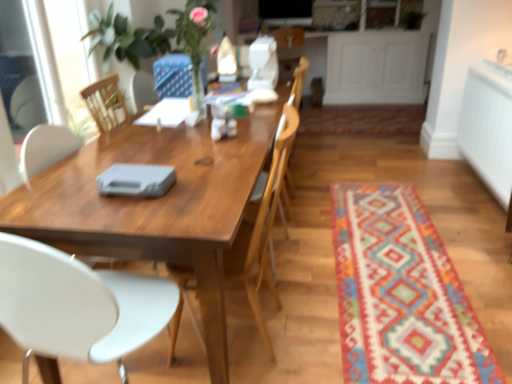
Based on the photo, what is the approximate width of wooden table at center?

80.85 centimeters.

What is the approximate width of blue fabric armchair at upper center, which is counted as the second armchair, starting from the right?

blue fabric armchair at upper center, which is counted as the second armchair, starting from the right, is 10.79 inches wide.

Measure the distance between blue fabric armchair at upper center, the 1th armchair viewed from the left, and camera.

blue fabric armchair at upper center, the 1th armchair viewed from the left, and camera are 8.07 feet apart from each other.

What do you see at coordinates (298, 81) in the screenshot? The height and width of the screenshot is (384, 512). I see `wooden chair at center, the 2th armchair in the left-to-right sequence` at bounding box center [298, 81].

Locate an element on the screen. Image resolution: width=512 pixels, height=384 pixels. wooden chair at center, which is the first chair in right-to-left order is located at coordinates (262, 226).

What is the approximate width of wooden chair at center, acting as the 2th chair starting from the left?

It is 19.82 inches.

The image size is (512, 384). What do you see at coordinates (401, 293) in the screenshot?
I see `multicolored woven mat at lower right, which ranks as the 2th mat in back-to-front order` at bounding box center [401, 293].

Identify the location of white textured radiator at right. (488, 126).

The width and height of the screenshot is (512, 384). Find the location of `wooden table at center`. wooden table at center is located at coordinates (155, 205).

Does white plastic chair at left, marked as the first chair in a left-to-right arrangement, contain wooden table at center?

No, wooden table at center is located outside of white plastic chair at left, marked as the first chair in a left-to-right arrangement.

Considering the points (150, 302) and (151, 212), which point is in front, point (150, 302) or point (151, 212)?

Positioned in front is point (151, 212).

Locate an element on the screen. kitchen & dining room table located above the white plastic chair at left, marked as the first chair in a left-to-right arrangement (from the image's perspective) is located at coordinates (155, 205).

From the image's perspective, is multicolored woven mat at lower right, the first mat in the front-to-back sequence, below multicolored woven rug at center, the first mat when ordered from top to bottom?

Yes, from the image's perspective, multicolored woven mat at lower right, the first mat in the front-to-back sequence, is below multicolored woven rug at center, the first mat when ordered from top to bottom.

Can you confirm if multicolored woven mat at lower right, the first mat in the front-to-back sequence, is smaller than multicolored woven rug at center, the first mat when ordered from top to bottom?

Correct, multicolored woven mat at lower right, the first mat in the front-to-back sequence, occupies less space than multicolored woven rug at center, the first mat when ordered from top to bottom.

Considering the sizes of objects multicolored woven mat at lower right, the first mat in the front-to-back sequence, and multicolored woven rug at center, which appears as the second mat when ordered from the bottom, in the image provided, who is thinner, multicolored woven mat at lower right, the first mat in the front-to-back sequence, or multicolored woven rug at center, which appears as the second mat when ordered from the bottom,?

Thinner between the two is multicolored woven mat at lower right, the first mat in the front-to-back sequence.

How many degrees apart are the facing directions of multicolored woven mat at lower right, the first mat positioned from the bottom, and multicolored woven rug at center, the first mat when ordered from top to bottom?

91.5 degrees.

Between multicolored woven mat at lower right, the first mat positioned from the bottom, and wooden chair at center, which is counted as the 1th armchair, starting from the right, which one is positioned behind?

wooden chair at center, which is counted as the 1th armchair, starting from the right, is behind.

How much distance is there between multicolored woven mat at lower right, the first mat in the front-to-back sequence, and wooden chair at center, which is counted as the 1th armchair, starting from the right?

multicolored woven mat at lower right, the first mat in the front-to-back sequence, and wooden chair at center, which is counted as the 1th armchair, starting from the right, are 3.34 feet apart from each other.

Would you say multicolored woven mat at lower right, arranged as the second mat when viewed from the top, contains wooden chair at center, which is counted as the 1th armchair, starting from the right?

Actually, wooden chair at center, which is counted as the 1th armchair, starting from the right, is outside multicolored woven mat at lower right, arranged as the second mat when viewed from the top.

Is multicolored woven mat at lower right, the first mat in the front-to-back sequence, looking in the opposite direction of wooden chair at center, the 2th armchair in the left-to-right sequence?

multicolored woven mat at lower right, the first mat in the front-to-back sequence, is not turned away from wooden chair at center, the 2th armchair in the left-to-right sequence.

Is white plastic chair at left, marked as the second chair in a right-to-left arrangement, thinner than wooden chair at center, acting as the 2th chair starting from the left?

Indeed, white plastic chair at left, marked as the second chair in a right-to-left arrangement, has a lesser width compared to wooden chair at center, acting as the 2th chair starting from the left.

Is white plastic chair at left, marked as the first chair in a left-to-right arrangement, spatially inside wooden chair at center, which is the first chair in right-to-left order, or outside of it?

white plastic chair at left, marked as the first chair in a left-to-right arrangement, exists outside the volume of wooden chair at center, which is the first chair in right-to-left order.

Between white plastic chair at left, marked as the first chair in a left-to-right arrangement, and wooden chair at center, which is the first chair in right-to-left order, which one has less height?

With less height is white plastic chair at left, marked as the first chair in a left-to-right arrangement.

Identify the location of chair above the white plastic chair at left, marked as the second chair in a right-to-left arrangement (from the image's perspective). (262, 226).

Is point (15, 191) positioned after point (417, 111)?

No, it is not.

From the image's perspective, which object appears higher, wooden table at center or multicolored woven rug at center, which is the first mat in back-to-front order?

From the image's view, multicolored woven rug at center, which is the first mat in back-to-front order, is above.

Does wooden table at center have a larger size compared to multicolored woven rug at center, which appears as the second mat when ordered from the bottom?

Yes.

Looking at this image, considering the relative positions of wooden table at center and multicolored woven rug at center, which is the first mat in back-to-front order, in the image provided, is wooden table at center to the left or to the right of multicolored woven rug at center, which is the first mat in back-to-front order,?

In the image, wooden table at center appears on the left side of multicolored woven rug at center, which is the first mat in back-to-front order.

Can you see multicolored woven rug at center, which appears as the second mat when viewed from the front, touching wooden chair at center, which is the first chair in right-to-left order?

No, multicolored woven rug at center, which appears as the second mat when viewed from the front, is not making contact with wooden chair at center, which is the first chair in right-to-left order.

Which is in front, multicolored woven rug at center, which appears as the second mat when viewed from the front, or wooden chair at center, acting as the 2th chair starting from the left?

wooden chair at center, acting as the 2th chair starting from the left, is closer to the camera.

Considering the sizes of objects multicolored woven rug at center, which is the first mat in back-to-front order, and wooden chair at center, which is the first chair in right-to-left order, in the image provided, who is smaller, multicolored woven rug at center, which is the first mat in back-to-front order, or wooden chair at center, which is the first chair in right-to-left order,?

multicolored woven rug at center, which is the first mat in back-to-front order.

What are the coordinates of `mat above the wooden chair at center, acting as the 2th chair starting from the left (from the image's perspective)` in the screenshot? It's located at (362, 119).

I want to click on kitchen & dining room table beneath the white textured radiator at right (from a real-world perspective), so click(155, 205).

Considering the relative sizes of wooden table at center and white textured radiator at right in the image provided, is wooden table at center taller than white textured radiator at right?

Indeed, wooden table at center has a greater height compared to white textured radiator at right.

Would you say wooden table at center contains white textured radiator at right?

No, wooden table at center does not contain white textured radiator at right.

Where is `the 2nd chair below the wooden table at center (from the image's perspective)`? The image size is (512, 384). the 2nd chair below the wooden table at center (from the image's perspective) is located at coordinates (77, 304).

At what (x,y) coordinates should I click in order to perform the action: click on mat on the left of the multicolored woven rug at center, which appears as the second mat when ordered from the bottom. Please return your answer as a coordinate pair (x, y). The width and height of the screenshot is (512, 384). Looking at the image, I should click on (401, 293).

Looking at the image, which one is located further to multicolored woven rug at center, which appears as the second mat when viewed from the front, white plastic chair at left, marked as the first chair in a left-to-right arrangement, or wooden chair at center, acting as the 2th chair starting from the left?

white plastic chair at left, marked as the first chair in a left-to-right arrangement, lies further to multicolored woven rug at center, which appears as the second mat when viewed from the front, than the other object.

Based on their spatial positions, is white plastic chair at left, marked as the second chair in a right-to-left arrangement, or multicolored woven mat at lower right, which ranks as the 2th mat in back-to-front order, further from blue fabric armchair at upper center, which is counted as the second armchair, starting from the right?

Among the two, white plastic chair at left, marked as the second chair in a right-to-left arrangement, is located further to blue fabric armchair at upper center, which is counted as the second armchair, starting from the right.

From the image, which object appears to be farther from multicolored woven mat at lower right, the first mat in the front-to-back sequence, wooden chair at center, the 2th armchair in the left-to-right sequence, or wooden table at center?

wooden chair at center, the 2th armchair in the left-to-right sequence, lies further to multicolored woven mat at lower right, the first mat in the front-to-back sequence, than the other object.

Looking at the image, which one is located closer to white textured radiator at right, multicolored woven mat at lower right, the first mat in the front-to-back sequence, or blue fabric armchair at upper center, the 1th armchair viewed from the left?

multicolored woven mat at lower right, the first mat in the front-to-back sequence, is closer to white textured radiator at right.

Estimate the real-world distances between objects in this image. Which object is further from wooden chair at center, acting as the 2th chair starting from the left, white plastic chair at left, marked as the second chair in a right-to-left arrangement, or white textured radiator at right?

Based on the image, white textured radiator at right appears to be further to wooden chair at center, acting as the 2th chair starting from the left.

Which object lies nearer to the anchor point wooden chair at center, acting as the 2th chair starting from the left, multicolored woven rug at center, which appears as the second mat when ordered from the bottom, or white textured radiator at right?

white textured radiator at right is positioned closer to the anchor wooden chair at center, acting as the 2th chair starting from the left.

When comparing their distances from wooden chair at center, acting as the 2th chair starting from the left, does multicolored woven rug at center, which appears as the second mat when viewed from the front, or wooden table at center seem further?

Among the two, multicolored woven rug at center, which appears as the second mat when viewed from the front, is located further to wooden chair at center, acting as the 2th chair starting from the left.

Looking at the image, which one is located closer to blue fabric armchair at upper center, which is counted as the second armchair, starting from the right, multicolored woven mat at lower right, arranged as the second mat when viewed from the top, or wooden chair at center, which is the first chair in right-to-left order?

Based on the image, wooden chair at center, which is the first chair in right-to-left order, appears to be nearer to blue fabric armchair at upper center, which is counted as the second armchair, starting from the right.

The height and width of the screenshot is (384, 512). Find the location of `mat located between white plastic chair at left, marked as the first chair in a left-to-right arrangement, and multicolored woven rug at center, which appears as the second mat when ordered from the bottom, in the depth direction`. mat located between white plastic chair at left, marked as the first chair in a left-to-right arrangement, and multicolored woven rug at center, which appears as the second mat when ordered from the bottom, in the depth direction is located at coordinates (401, 293).

Locate an element on the screen. chair between wooden table at center and multicolored woven rug at center, the first mat when ordered from top to bottom, from front to back is located at coordinates (262, 226).

Where is `mat between white plastic chair at left, marked as the first chair in a left-to-right arrangement, and blue fabric armchair at upper center, the 1th armchair viewed from the left, along the z-axis`? Image resolution: width=512 pixels, height=384 pixels. mat between white plastic chair at left, marked as the first chair in a left-to-right arrangement, and blue fabric armchair at upper center, the 1th armchair viewed from the left, along the z-axis is located at coordinates (401, 293).

What are the coordinates of `armchair positioned between white plastic chair at left, marked as the first chair in a left-to-right arrangement, and blue fabric armchair at upper center, the 1th armchair viewed from the left, from near to far` in the screenshot? It's located at (298, 81).